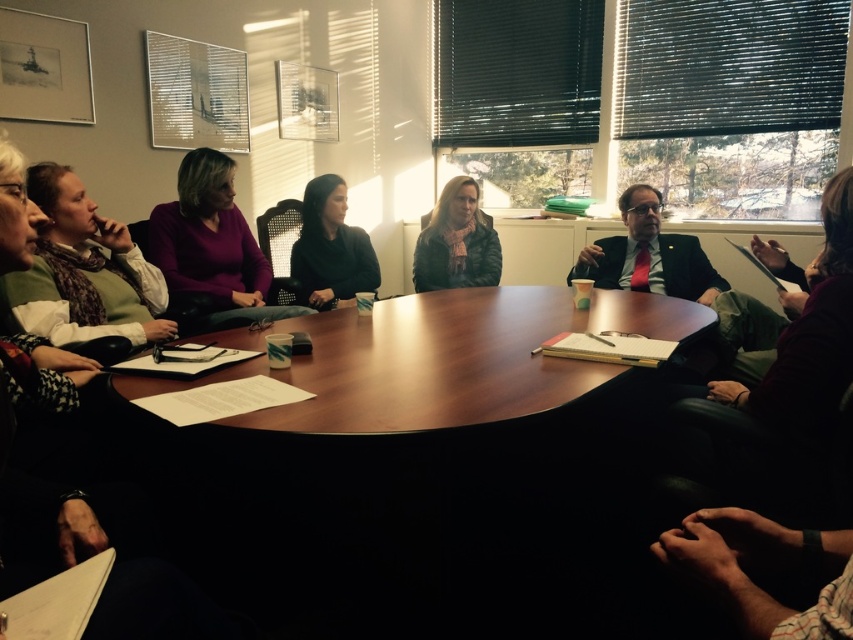
Looking at this image, is matte purple sweater at center below black matte sweater at center?

Yes, matte purple sweater at center is below black matte sweater at center.

At what (x,y) coordinates should I click in order to perform the action: click on matte purple sweater at center. Please return your answer as a coordinate pair (x, y). Looking at the image, I should click on (210, 250).

The height and width of the screenshot is (640, 853). I want to click on matte purple sweater at center, so click(210, 250).

The width and height of the screenshot is (853, 640). Identify the location of matte purple sweater at center. (210, 250).

Does green sweater at left have a greater height compared to matte black jacket at center?

In fact, green sweater at left may be shorter than matte black jacket at center.

Is green sweater at left above matte black jacket at center?

No.

Does point (80, 216) come closer to viewer compared to point (447, 216)?

Yes, point (80, 216) is closer to viewer.

This screenshot has height=640, width=853. In order to click on green sweater at left in this screenshot , I will do `click(84, 272)`.

Based on the photo, can you confirm if green sweater at left is bigger than black matte sweater at center?

Yes.

Who is shorter, green sweater at left or black matte sweater at center?

With less height is green sweater at left.

Which is behind, point (155, 339) or point (310, 188)?

The point (310, 188) is behind.

Find the location of a particular element. The image size is (853, 640). green sweater at left is located at coordinates (84, 272).